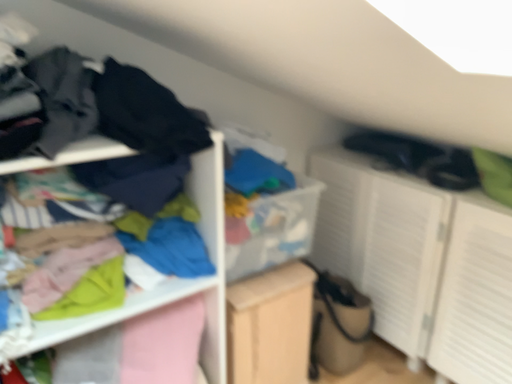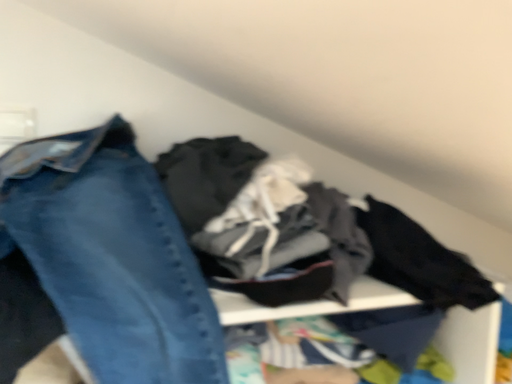
Question: How did the camera likely rotate when shooting the video?

Choices:
 (A) rotated downward
 (B) rotated upward

Answer: (B)